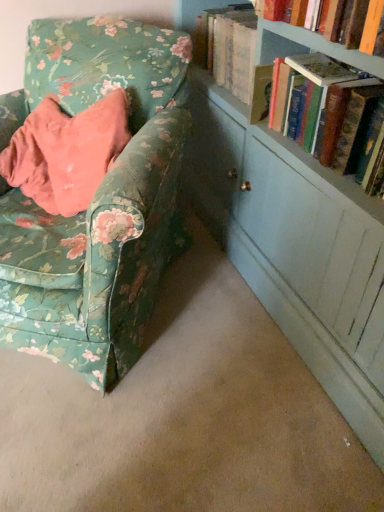
Question: Is floral fabric chair at left to the left or to the right of hardcover book at upper right in the image?

Choices:
 (A) right
 (B) left

Answer: (B)

Question: In terms of height, does floral fabric chair at left look taller or shorter compared to hardcover book at upper right?

Choices:
 (A) tall
 (B) short

Answer: (A)

Question: Looking at their shapes, would you say floral fabric chair at left is wider or thinner than hardcover book at upper right?

Choices:
 (A) thin
 (B) wide

Answer: (B)

Question: Which is correct: hardcover book at upper right is inside floral fabric chair at left, or outside of it?

Choices:
 (A) inside
 (B) outside

Answer: (B)

Question: From the image's perspective, relative to floral fabric chair at left, is hardcover book at upper right above or below?

Choices:
 (A) above
 (B) below

Answer: (A)

Question: Is hardcover book at upper right in front of or behind floral fabric chair at left in the image?

Choices:
 (A) front
 (B) behind

Answer: (B)

Question: Looking at the image, does hardcover book at upper right seem bigger or smaller compared to floral fabric chair at left?

Choices:
 (A) small
 (B) big

Answer: (A)